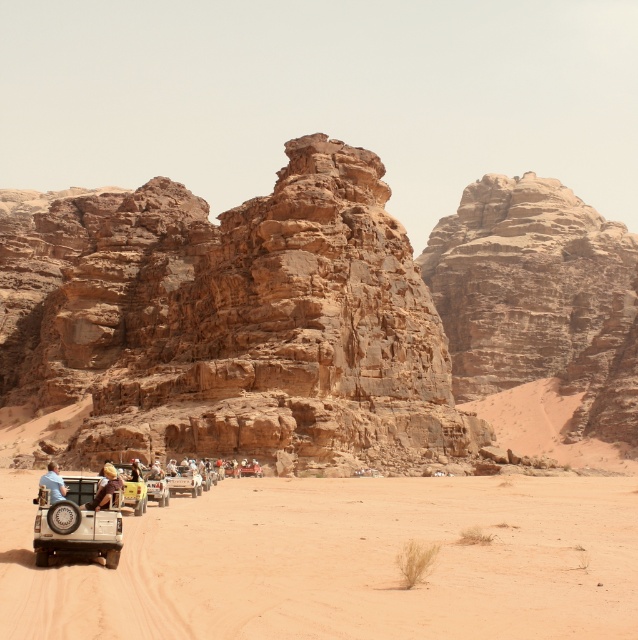
You are standing in the desert scene and want to reach a specific point marked as point (105, 492). If your current position is 100 feet away from this point, how much farther do you need to walk to reach it?

The distance of point (105, 492) from the viewer is 135.11 feet. Since you are currently 100 feet away, you need to walk an additional 35.11 feet to reach it.

You are a hiker planning to cross the desert and see the brown sandy dirt track at lower left and the light brown leather jacket at lower left. Which object is wider?

The brown sandy dirt track at lower left is wider than the light brown leather jacket at lower left.

You are planning a desert expedition and need to know the exact location of the brown sandy dirt track at lower left. What are the coordinates of this track?

The coordinates of the brown sandy dirt track at lower left are at point (x=339, y=561).